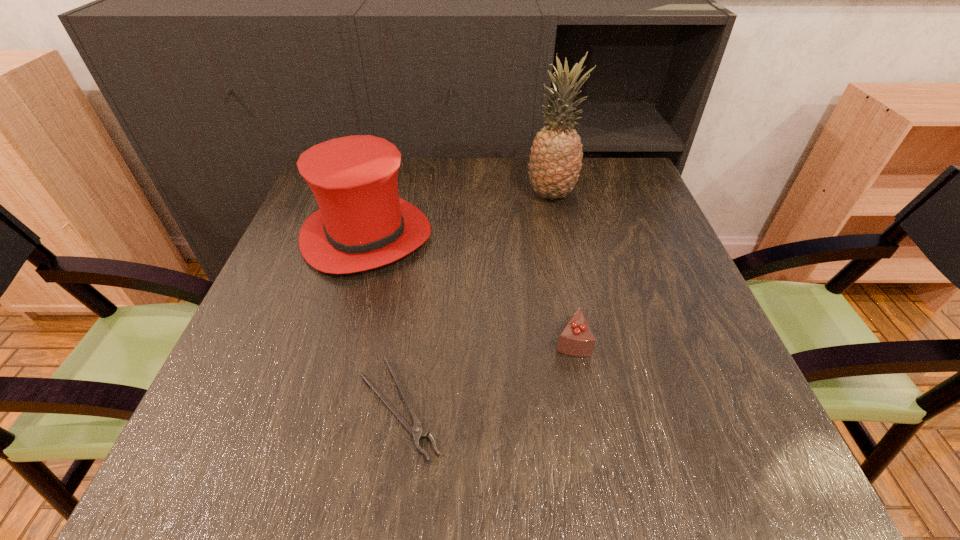
The width and height of the screenshot is (960, 540). In order to click on free spot between the chocolate cake and the tallest object in this screenshot , I will do pyautogui.click(x=561, y=267).

Locate an element on the screen. The width and height of the screenshot is (960, 540). free spot between the tallest object and the tongs is located at coordinates (475, 302).

Find the location of a particular element. This screenshot has width=960, height=540. free space between the second shortest object and the shortest object is located at coordinates (485, 374).

Where is `free point between the hat and the tallest object`? free point between the hat and the tallest object is located at coordinates pos(459,215).

Where is `vacant point located between the pineapple and the second tallest object`? This screenshot has height=540, width=960. vacant point located between the pineapple and the second tallest object is located at coordinates (459, 215).

At what (x,y) coordinates should I click in order to perform the action: click on vacant region between the third tallest object and the pineapple. Please return your answer as a coordinate pair (x, y). This screenshot has height=540, width=960. Looking at the image, I should click on (561, 267).

The width and height of the screenshot is (960, 540). Identify the location of free space between the hat and the nearest object. (383, 322).

The height and width of the screenshot is (540, 960). I want to click on free spot between the shortest object and the third shortest object, so click(x=383, y=322).

Locate an element on the screen. This screenshot has height=540, width=960. free space between the tallest object and the second tallest object is located at coordinates (459, 215).

This screenshot has height=540, width=960. Find the location of `unoccupied area between the shortest object and the second nearest object`. unoccupied area between the shortest object and the second nearest object is located at coordinates (485, 374).